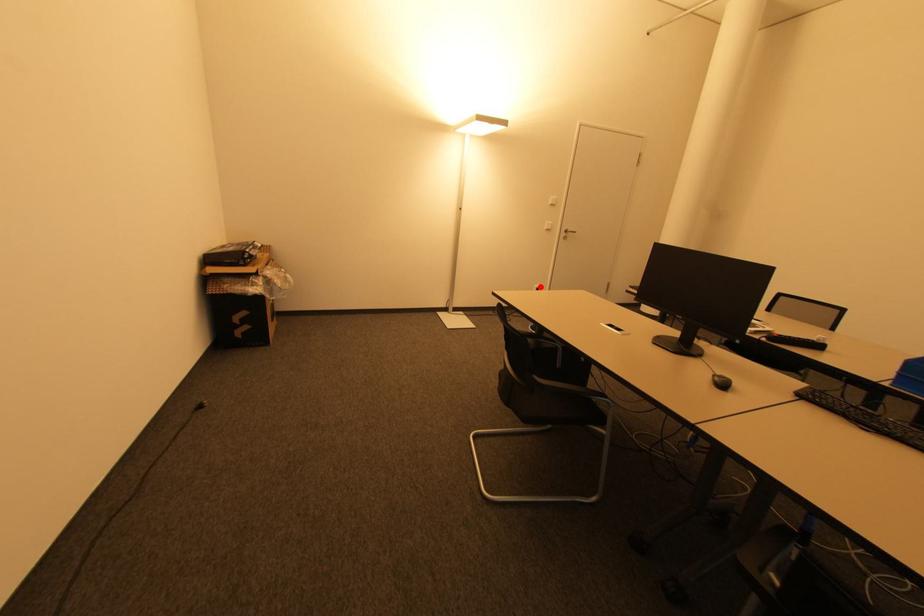
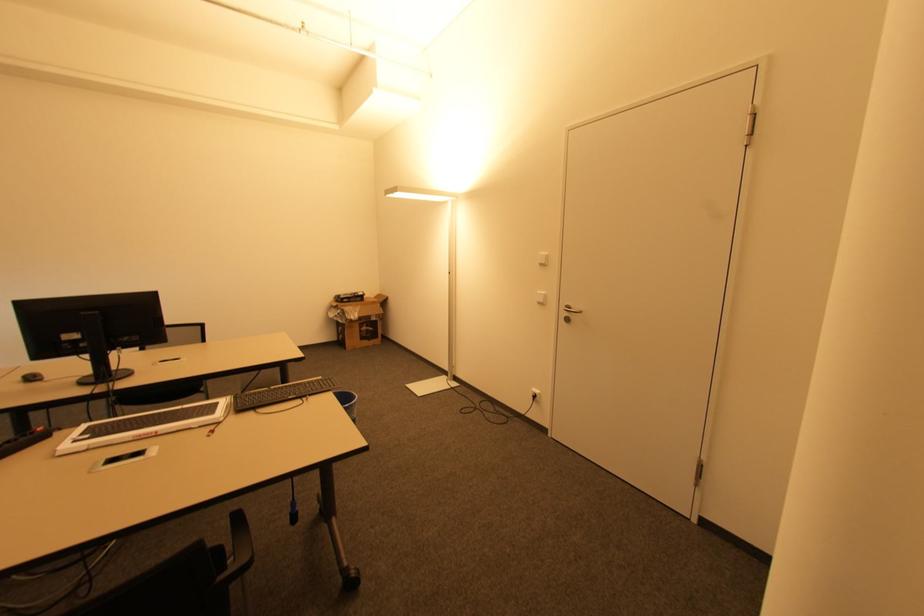
Question: I am providing you with two images of the same scene from different viewpoints. Image1 has a red point marked. In image2, the corresponding 3D location appears at what relative position? Reply with the corresponding letter.

Choices:
 (A) Closer
 (B) Farther

Answer: (B)